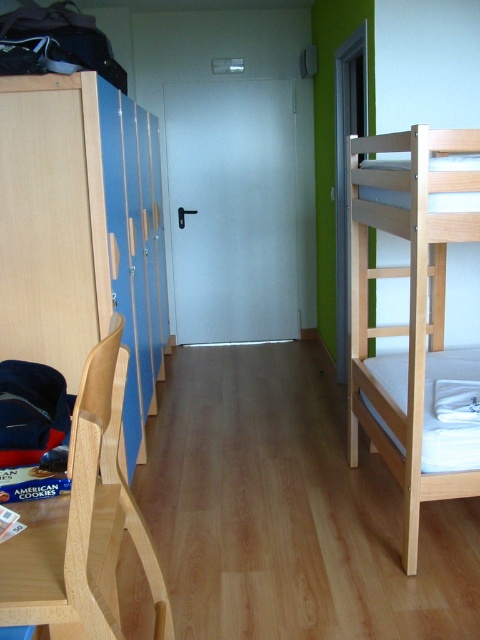
Question: Can you confirm if blue matte locker at left is wider than light wood/wooden chair at left?

Choices:
 (A) yes
 (B) no

Answer: (A)

Question: Which point appears farthest from the camera in this image?

Choices:
 (A) (443, 486)
 (B) (84, 564)
 (C) (12, 246)

Answer: (C)

Question: Which of the following is the farthest from the observer?

Choices:
 (A) pyautogui.click(x=361, y=237)
 (B) pyautogui.click(x=81, y=577)
 (C) pyautogui.click(x=16, y=202)

Answer: (A)

Question: Is blue matte locker at left above natural wood bunk bed at right?

Choices:
 (A) no
 (B) yes

Answer: (B)

Question: Which point is farther to the camera?

Choices:
 (A) light wood/wooden chair at left
 (B) blue matte locker at left

Answer: (B)

Question: Does blue matte locker at left have a lesser width compared to light wood/wooden chair at left?

Choices:
 (A) yes
 (B) no

Answer: (B)